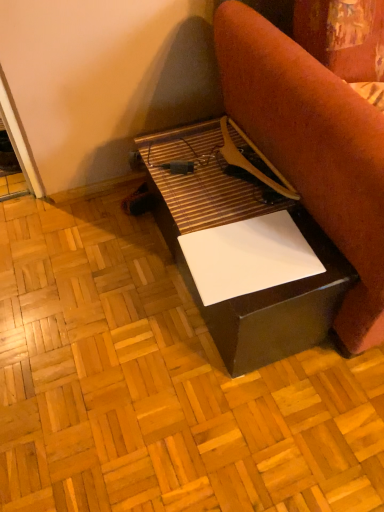
Question: Considering the relative positions of white glossy plywood at center and matte black table at center in the image provided, is white glossy plywood at center to the left of matte black table at center from the viewer's perspective?

Choices:
 (A) yes
 (B) no

Answer: (A)

Question: Does white glossy plywood at center have a greater width compared to matte black table at center?

Choices:
 (A) yes
 (B) no

Answer: (A)

Question: From a real-world perspective, is white glossy plywood at center positioned under matte black table at center based on gravity?

Choices:
 (A) no
 (B) yes

Answer: (B)

Question: Considering the relative sizes of white glossy plywood at center and matte black table at center in the image provided, is white glossy plywood at center thinner than matte black table at center?

Choices:
 (A) no
 (B) yes

Answer: (A)

Question: Considering the relative sizes of white glossy plywood at center and matte black table at center in the image provided, is white glossy plywood at center shorter than matte black table at center?

Choices:
 (A) yes
 (B) no

Answer: (A)

Question: Considering the positions of matte black table at center and white glossy paper at center in the image, is matte black table at center wider or thinner than white glossy paper at center?

Choices:
 (A) wide
 (B) thin

Answer: (B)

Question: Is matte black table at center in front of or behind white glossy paper at center in the image?

Choices:
 (A) front
 (B) behind

Answer: (B)

Question: Based on their sizes in the image, would you say matte black table at center is bigger or smaller than white glossy paper at center?

Choices:
 (A) small
 (B) big

Answer: (A)

Question: From a real-world perspective, is matte black table at center positioned above or below white glossy paper at center?

Choices:
 (A) below
 (B) above

Answer: (A)

Question: In terms of width, does white glossy paper at center look wider or thinner when compared to matte black table at center?

Choices:
 (A) wide
 (B) thin

Answer: (A)

Question: Considering the positions of white glossy paper at center and matte black table at center in the image, is white glossy paper at center taller or shorter than matte black table at center?

Choices:
 (A) tall
 (B) short

Answer: (A)

Question: Is white glossy paper at center bigger or smaller than matte black table at center?

Choices:
 (A) small
 (B) big

Answer: (B)

Question: Is point (228, 52) closer or farther from the camera than point (188, 129)?

Choices:
 (A) closer
 (B) farther

Answer: (A)

Question: Considering the positions of point (x=158, y=336) and point (x=216, y=42), is point (x=158, y=336) closer or farther from the camera than point (x=216, y=42)?

Choices:
 (A) farther
 (B) closer

Answer: (A)

Question: From the image's perspective, is white glossy plywood at center positioned above or below white glossy paper at center?

Choices:
 (A) above
 (B) below

Answer: (B)